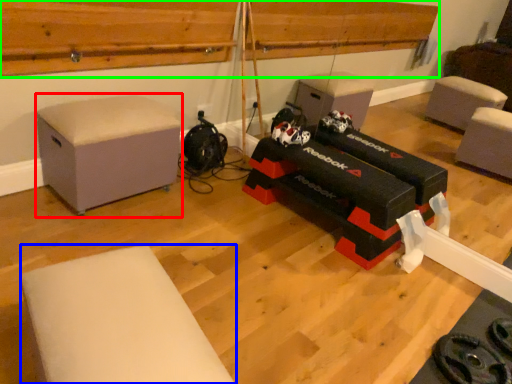
Question: Which object is positioned farthest from furniture (highlighted by a red box)? Select from furniture (highlighted by a blue box) and wood (highlighted by a green box).

Choices:
 (A) furniture
 (B) wood

Answer: (A)